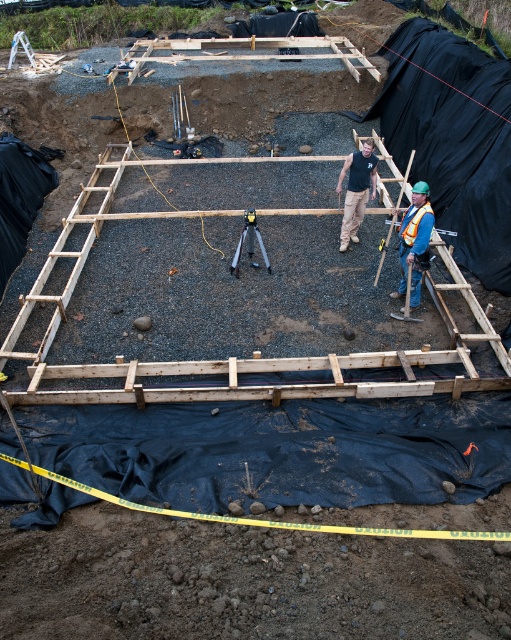
Image resolution: width=511 pixels, height=640 pixels. Describe the element at coordinates (357, 189) in the screenshot. I see `black tank top at center` at that location.

Can you confirm if black tank top at center is shorter than metallic tripod at center?

In fact, black tank top at center may be taller than metallic tripod at center.

Which is in front, point (340, 227) or point (251, 250)?

Point (251, 250) is in front.

Where is `black tank top at center`? black tank top at center is located at coordinates coord(357,189).

Does blue reflective vest at center have a greater height compared to metallic tripod at center?

Correct, blue reflective vest at center is much taller as metallic tripod at center.

Measure the distance from blue reflective vest at center to metallic tripod at center.

blue reflective vest at center and metallic tripod at center are 2.25 meters apart from each other.

Where is `blue reflective vest at center`? blue reflective vest at center is located at coordinates (413, 243).

Where is `blue reflective vest at center`? The width and height of the screenshot is (511, 640). blue reflective vest at center is located at coordinates (413, 243).

Can you confirm if blue reflective vest at center is smaller than black tank top at center?

Indeed, blue reflective vest at center has a smaller size compared to black tank top at center.

Is blue reflective vest at center bigger than black tank top at center?

Actually, blue reflective vest at center might be smaller than black tank top at center.

At what (x,y) coordinates should I click in order to perform the action: click on blue reflective vest at center. Please return your answer as a coordinate pair (x, y). Image resolution: width=511 pixels, height=640 pixels. Looking at the image, I should click on (413, 243).

Locate an element on the screen. Image resolution: width=511 pixels, height=640 pixels. blue reflective vest at center is located at coordinates (413, 243).